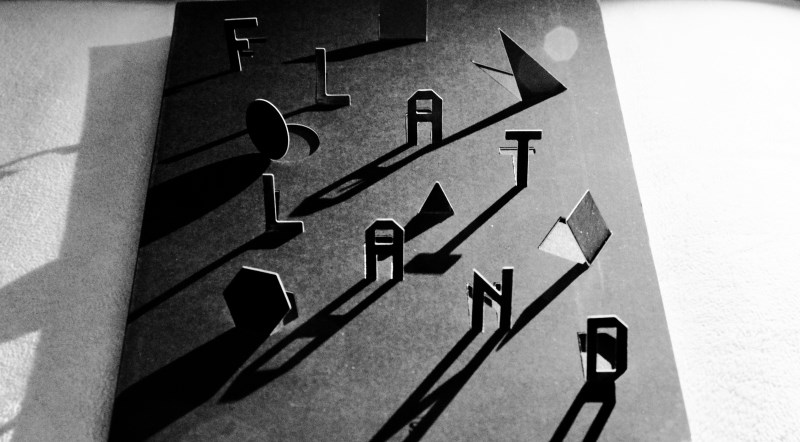
At what (x,y) coordinates should I click in order to perform the action: click on white carpet. Please return your answer as a coordinate pair (x, y). This screenshot has width=800, height=442. Looking at the image, I should click on (50, 91).